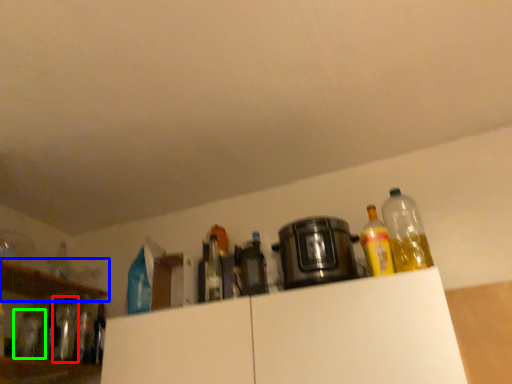
Question: Estimate the real-world distances between objects in this image. Which object is farther from bottle (highlighted by a red box), shelf (highlighted by a blue box) or bottle (highlighted by a green box)?

Choices:
 (A) shelf
 (B) bottle

Answer: (A)